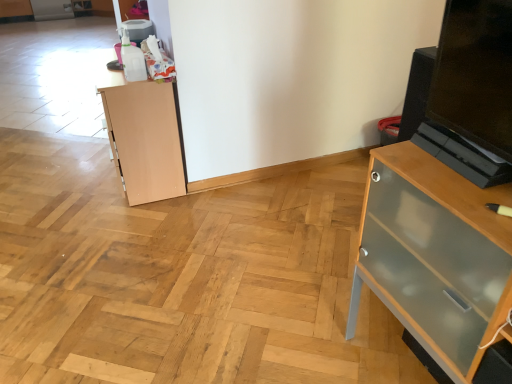
The width and height of the screenshot is (512, 384). I want to click on vacant region in front of light brown wood cupboard at left, so click(120, 221).